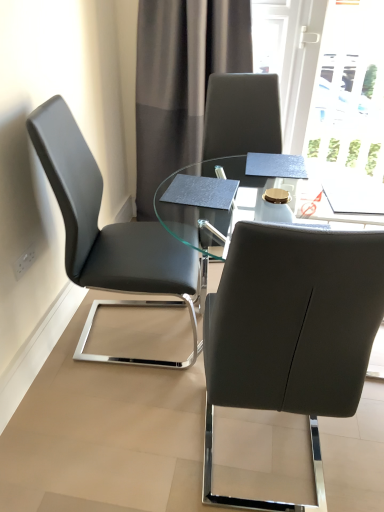
Find the location of a particular element. empty space that is in between matte black chair at center, the first chair when ordered from right to left, and transparent glass table at center is located at coordinates click(268, 457).